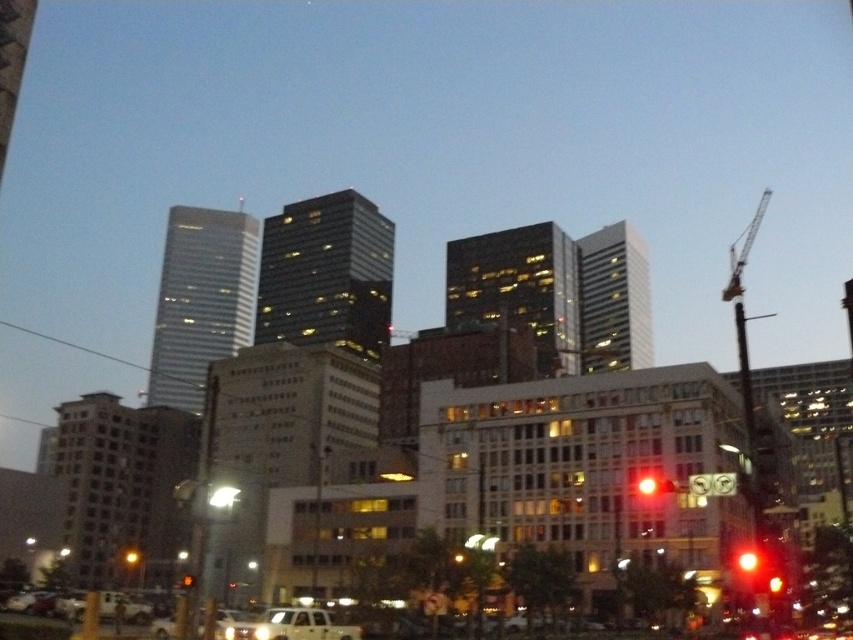
Question: Which point is closer to the camera?

Choices:
 (A) white matte van at lower center
 (B) red glass traffic light at center

Answer: (A)

Question: Is white matte van at lower center below red glass traffic light at center?

Choices:
 (A) yes
 (B) no

Answer: (B)

Question: Does white matte van at lower center have a smaller size compared to red glass traffic light at center?

Choices:
 (A) no
 (B) yes

Answer: (B)

Question: Which point is farther to the camera?

Choices:
 (A) (299, 628)
 (B) (183, 586)

Answer: (B)

Question: Can you confirm if white matte van at lower center is positioned below red glass traffic light at center?

Choices:
 (A) no
 (B) yes

Answer: (A)